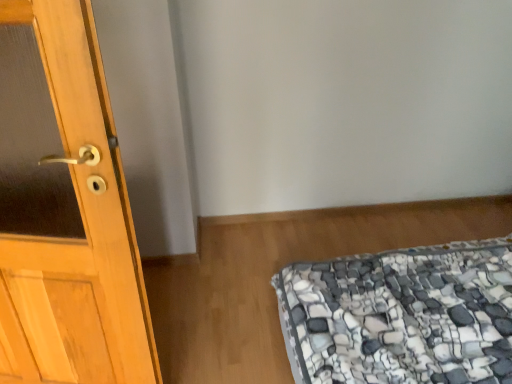
Question: Would you say light wood door at left is inside or outside stone-patterned fabric at lower right?

Choices:
 (A) outside
 (B) inside

Answer: (A)

Question: From their relative heights in the image, would you say light wood door at left is taller or shorter than stone-patterned fabric at lower right?

Choices:
 (A) short
 (B) tall

Answer: (B)

Question: From the image's perspective, relative to stone-patterned fabric at lower right, is light wood door at left above or below?

Choices:
 (A) above
 (B) below

Answer: (A)

Question: Is stone-patterned fabric at lower right wider or thinner than light wood door at left?

Choices:
 (A) thin
 (B) wide

Answer: (B)

Question: Is point (486, 261) closer or farther from the camera than point (139, 279)?

Choices:
 (A) closer
 (B) farther

Answer: (B)

Question: Is stone-patterned fabric at lower right spatially inside light wood door at left, or outside of it?

Choices:
 (A) outside
 (B) inside

Answer: (A)

Question: Would you say stone-patterned fabric at lower right is to the left or to the right of light wood door at left in the picture?

Choices:
 (A) left
 (B) right

Answer: (B)